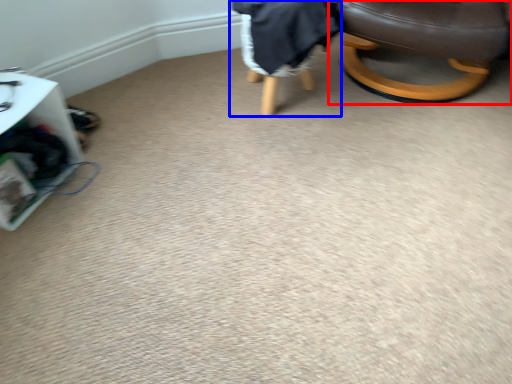
Question: Which of the following is the farthest to the observer, chair (highlighted by a red box) or bean bag chair (highlighted by a blue box)?

Choices:
 (A) chair
 (B) bean bag chair

Answer: (B)